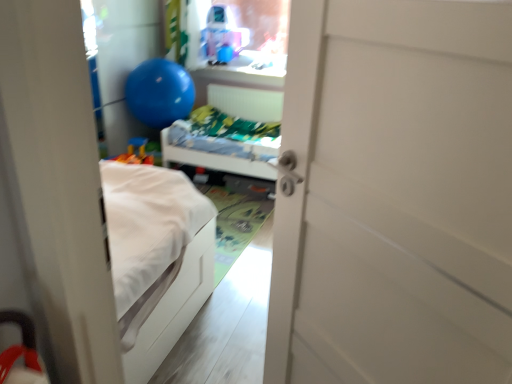
Question: Is translucent plastic toy at upper center with white matte hospital bed at center?

Choices:
 (A) no
 (B) yes

Answer: (A)

Question: Is translucent plastic toy at upper center far from white matte hospital bed at center?

Choices:
 (A) yes
 (B) no

Answer: (A)

Question: From a real-world perspective, is translucent plastic toy at upper center on white matte hospital bed at center?

Choices:
 (A) no
 (B) yes

Answer: (B)

Question: Can you confirm if translucent plastic toy at upper center is wider than white matte hospital bed at center?

Choices:
 (A) no
 (B) yes

Answer: (A)

Question: Is translucent plastic toy at upper center bigger than white matte hospital bed at center?

Choices:
 (A) yes
 (B) no

Answer: (B)

Question: Is translucent plastic toy at upper center facing away from white matte hospital bed at center?

Choices:
 (A) yes
 (B) no

Answer: (B)

Question: Is white matte door at center oriented away from white matte hospital bed at center?

Choices:
 (A) yes
 (B) no

Answer: (B)

Question: Are white matte door at center and white matte hospital bed at center far apart?

Choices:
 (A) yes
 (B) no

Answer: (A)

Question: Does white matte door at center have a lesser height compared to white matte hospital bed at center?

Choices:
 (A) no
 (B) yes

Answer: (A)

Question: Can you confirm if white matte door at center is positioned to the left of white matte hospital bed at center?

Choices:
 (A) no
 (B) yes

Answer: (A)

Question: From a real-world perspective, is white matte door at center on white matte hospital bed at center?

Choices:
 (A) no
 (B) yes

Answer: (B)

Question: From a real-world perspective, is white matte door at center located beneath white matte hospital bed at center?

Choices:
 (A) yes
 (B) no

Answer: (B)

Question: Considering the relative sizes of blue rubber balloon at upper left and translucent plastic toy at upper center in the image provided, is blue rubber balloon at upper left thinner than translucent plastic toy at upper center?

Choices:
 (A) no
 (B) yes

Answer: (A)